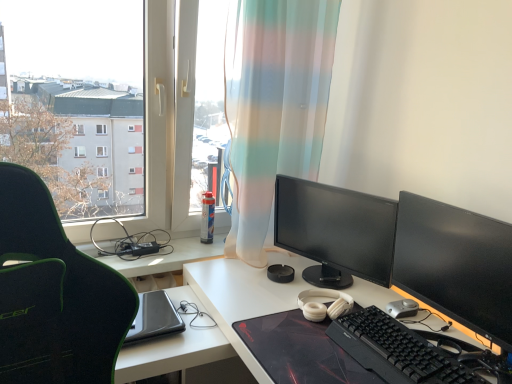
Locate an element on the screen. Image resolution: width=512 pixels, height=384 pixels. blank space situated above black plastic keyboard at lower right (from a real-world perspective) is located at coordinates (414, 344).